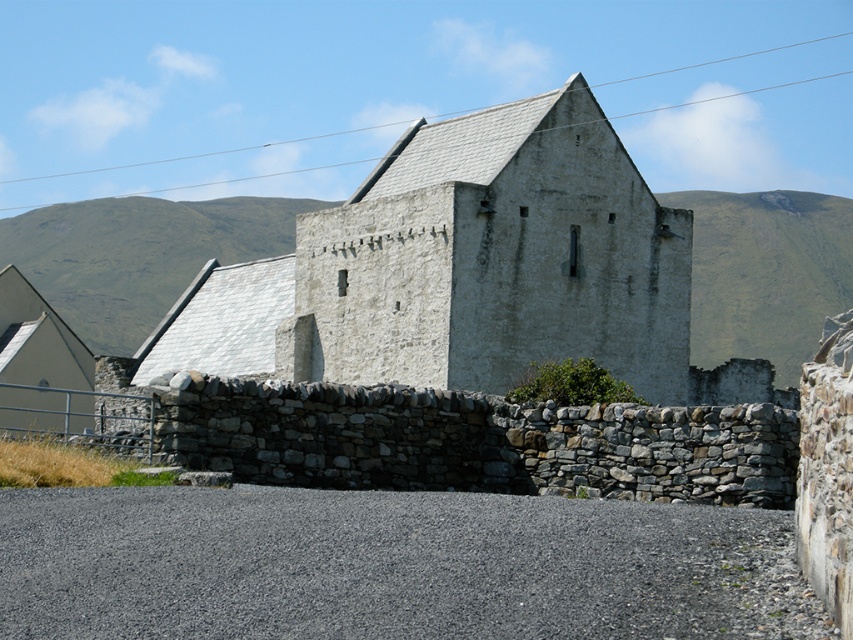
You are standing at the base of the green grassy hillside at upper left and want to walk to the white stone chapel at center. Which direction should you head towards?

The white stone chapel at center is located in front of the green grassy hillside at upper left, so you should head towards the center direction from the hillside to reach the chapel.